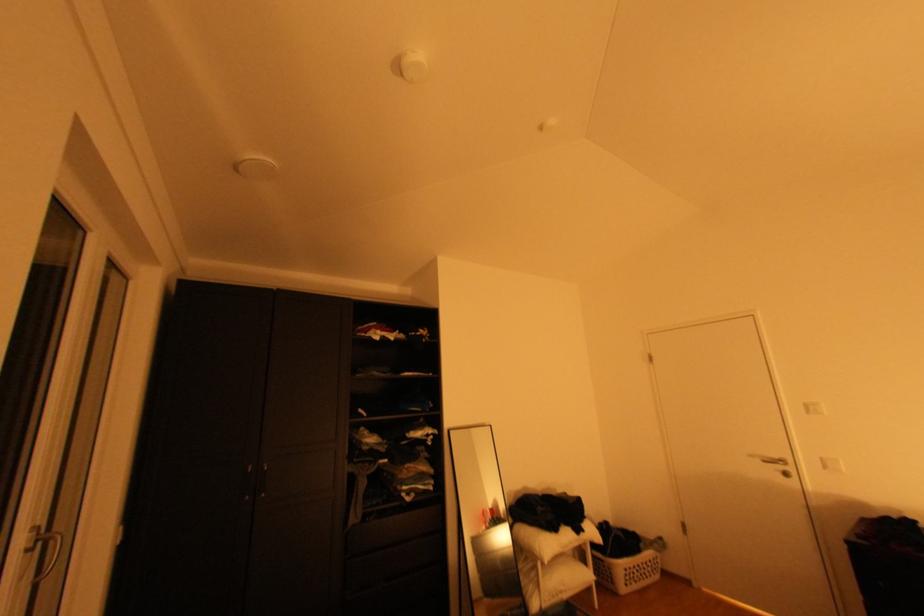
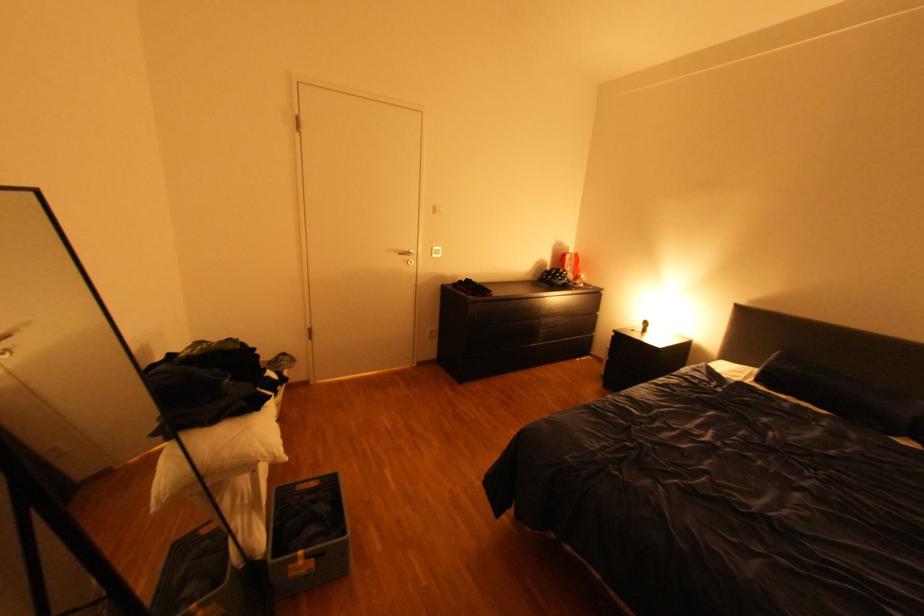
In the second image, find the point that corresponds to the point at 762,456 in the first image.

(399, 249)